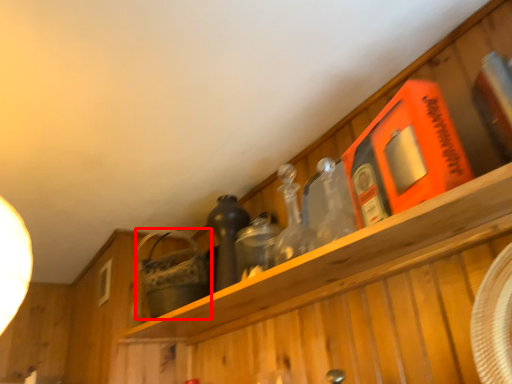
Question: From the image, what is the correct spatial relationship of basket (annotated by the red box) in relation to bottle?

Choices:
 (A) right
 (B) left

Answer: (B)